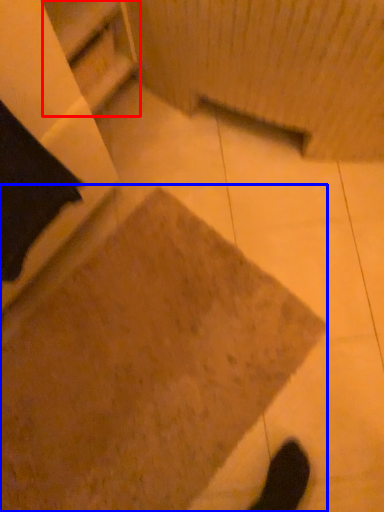
Question: Which object appears farthest to the camera in this image, shelf (highlighted by a red box) or concrete (highlighted by a blue box)?

Choices:
 (A) shelf
 (B) concrete

Answer: (B)